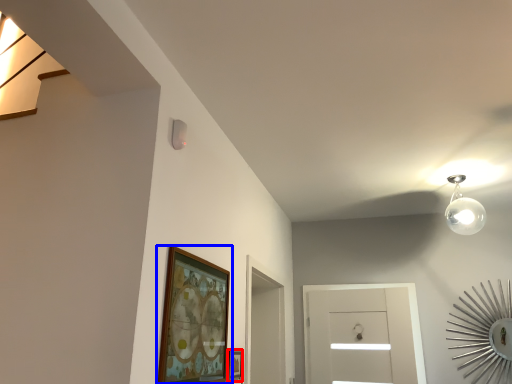
Question: Which object is closer to the camera taking this photo, picture frame (highlighted by a red box) or picture frame (highlighted by a blue box)?

Choices:
 (A) picture frame
 (B) picture frame

Answer: (B)